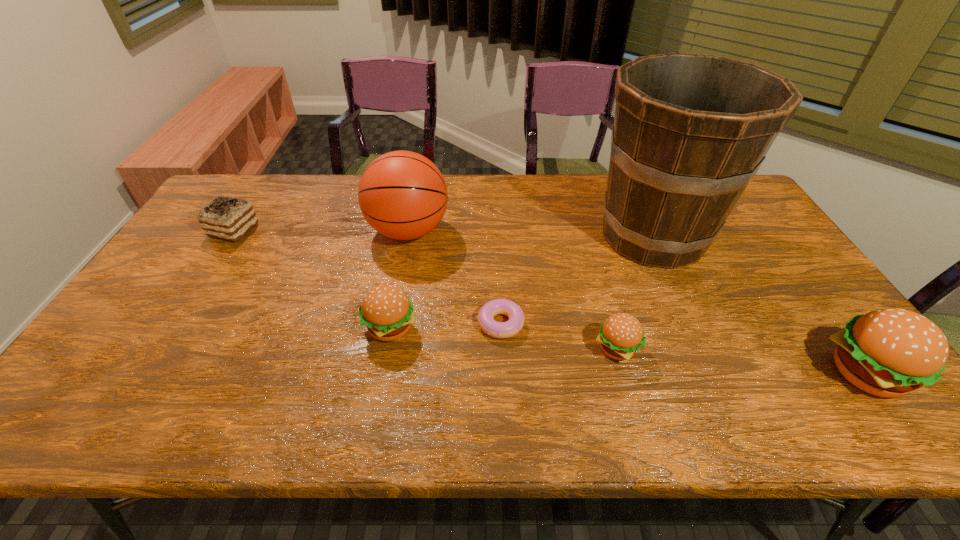
Identify the location of vacant area that satisfies the following two spatial constraints: 1. on the front side of the rightmost object; 2. on the left side of the tallest object. click(x=715, y=373).

You are a GUI agent. You are given a task and a screenshot of the screen. Output one action in this format:
    pyautogui.click(x=<x>, y=<y>)
    Task: Click on the vacant space that satisfies the following two spatial constraints: 1. on the front side of the basketball; 2. on the left side of the fourth object from left to right
    This screenshot has width=960, height=540.
    Given the screenshot: What is the action you would take?
    pyautogui.click(x=391, y=323)

Locate an element on the screen. This screenshot has height=540, width=960. vacant space that satisfies the following two spatial constraints: 1. on the front side of the chocolate cake; 2. on the right side of the shortest object is located at coordinates (174, 323).

This screenshot has width=960, height=540. I want to click on free region that satisfies the following two spatial constraints: 1. on the front side of the basketball; 2. on the left side of the tallest hamburger, so pos(382,373).